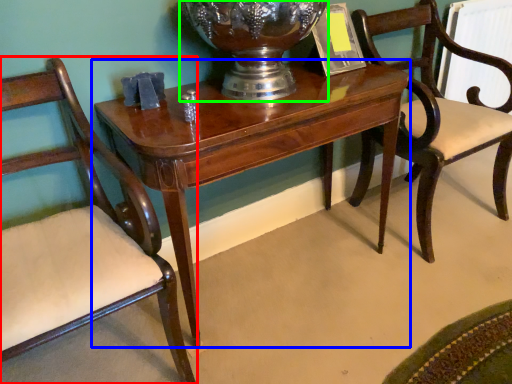
Question: Based on their relative distances, which object is nearer to chair (highlighted by a red box)? Choose from table (highlighted by a blue box) and glass vase (highlighted by a green box).

Choices:
 (A) table
 (B) glass vase

Answer: (A)